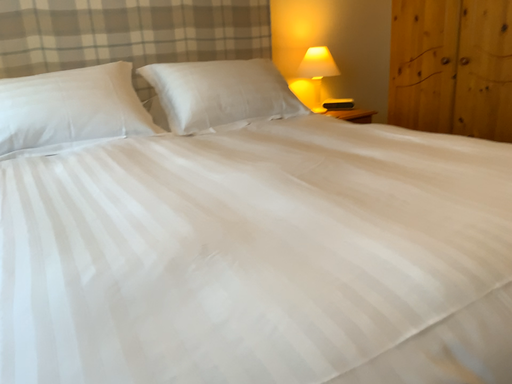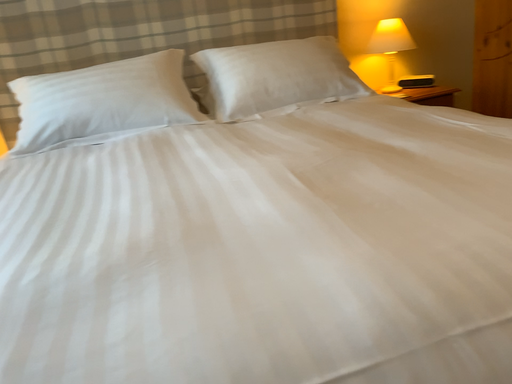
Question: How did the camera likely rotate when shooting the video?

Choices:
 (A) rotated right
 (B) rotated left

Answer: (B)